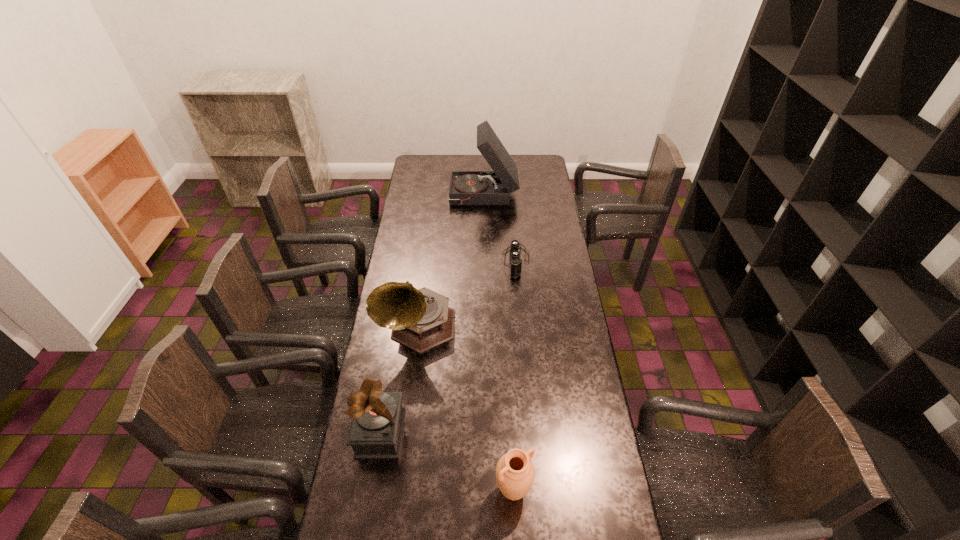
Locate an element on the screen. Image resolution: width=960 pixels, height=540 pixels. vacant space located on the front-facing side of the tallest object is located at coordinates (420, 196).

Image resolution: width=960 pixels, height=540 pixels. I want to click on free space located 0.260m on the horn direction of the second nearest phonograph_record, so click(x=405, y=430).

Locate an element on the screen. free location located 0.240m at the horn opening of the nearest phonograph_record is located at coordinates (479, 433).

This screenshot has width=960, height=540. In order to click on free point located on the back of the urn in this screenshot , I will do `click(507, 374)`.

Find the location of a particular element. Image resolution: width=960 pixels, height=540 pixels. vacant space located on the front of the binoculars is located at coordinates (521, 332).

At what (x,y) coordinates should I click in order to perform the action: click on vacant space at the left edge of the desktop. Please return your answer as a coordinate pair (x, y). This screenshot has height=540, width=960. Looking at the image, I should click on (413, 276).

In the image, there is a desktop. Identify the location of vacant area at the right edge. (588, 487).

Locate an element on the screen. The width and height of the screenshot is (960, 540). vacant area at the far left corner of the desktop is located at coordinates (418, 173).

Where is `vacant space at the far right corner of the desktop`? Image resolution: width=960 pixels, height=540 pixels. vacant space at the far right corner of the desktop is located at coordinates (542, 174).

This screenshot has width=960, height=540. What are the coordinates of `free space between the second nearest phonograph_record and the nearest phonograph_record` in the screenshot? It's located at (399, 380).